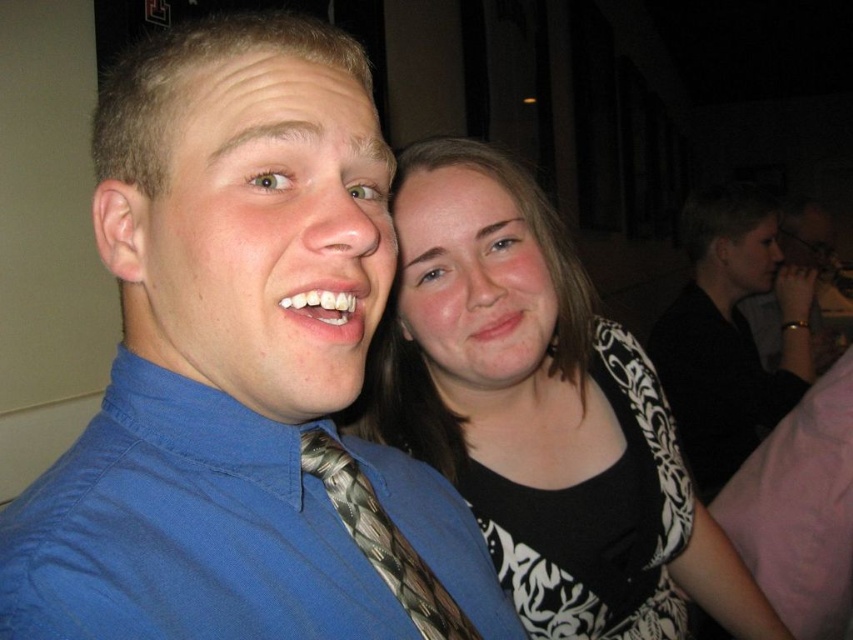
Is point (701, 339) farther from viewer compared to point (415, 228)?

Yes, it is.

This screenshot has height=640, width=853. What do you see at coordinates (730, 333) in the screenshot?
I see `black matte shirt at right` at bounding box center [730, 333].

The image size is (853, 640). I want to click on black matte shirt at right, so click(730, 333).

Does blue textured shirt at left have a smaller size compared to black and white patterned dress at upper right?

Yes.

Is point (57, 554) positioned before point (619, 529)?

Yes, it is in front of point (619, 529).

What do you see at coordinates (242, 372) in the screenshot? I see `blue textured shirt at left` at bounding box center [242, 372].

Locate an element on the screen. This screenshot has width=853, height=640. blue textured shirt at left is located at coordinates (242, 372).

Between blue fabric face at center and matte black hair at upper right, which one is positioned higher?

Positioned higher is matte black hair at upper right.

Which of these two, blue fabric face at center or matte black hair at upper right, stands taller?

With more height is matte black hair at upper right.

Between point (267, 61) and point (712, 259), which one is positioned behind?

Positioned behind is point (712, 259).

At what (x,y) coordinates should I click in order to perform the action: click on blue fabric face at center. Please return your answer as a coordinate pair (x, y). Looking at the image, I should click on (x=263, y=236).